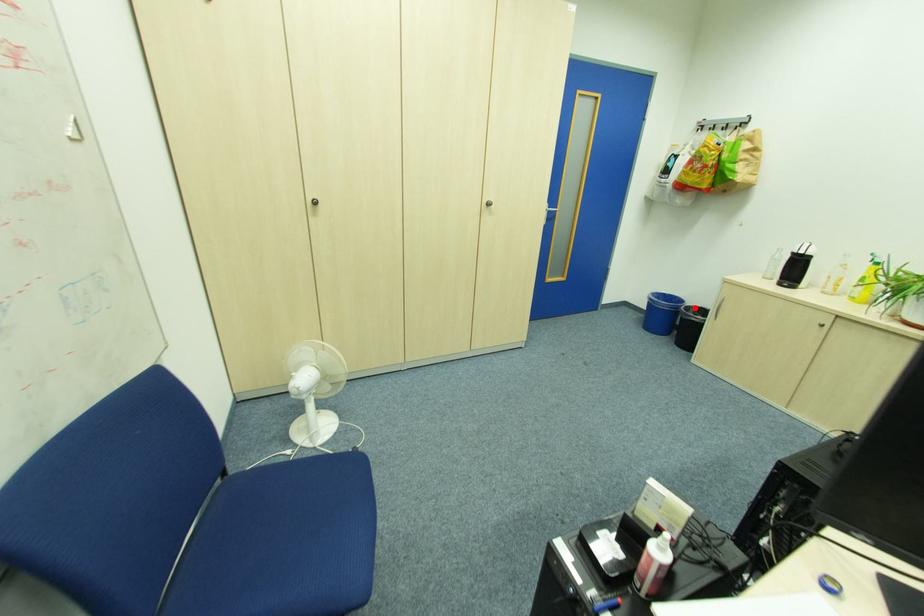
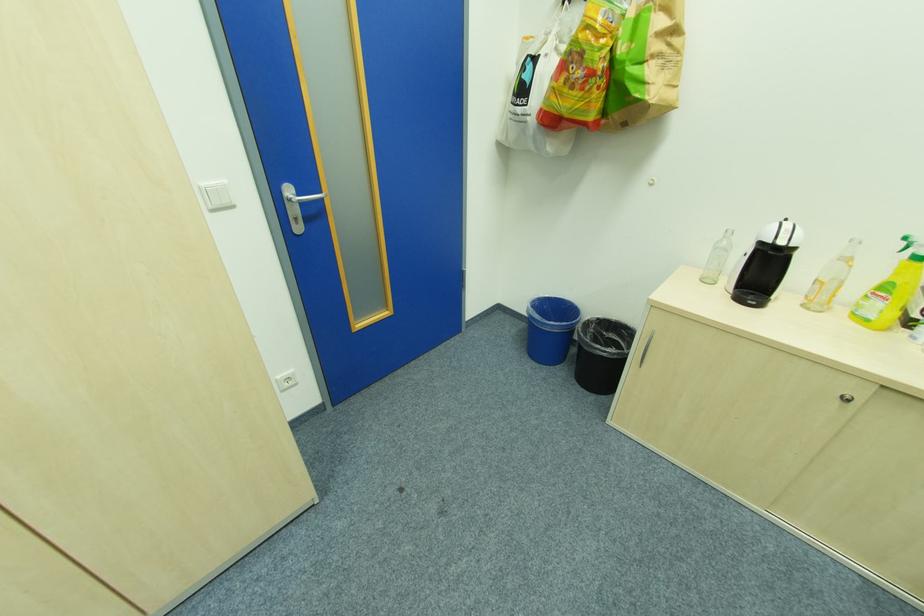
Locate, in the second image, the point that corresponds to the highlighted location in the first image.

(592, 322)